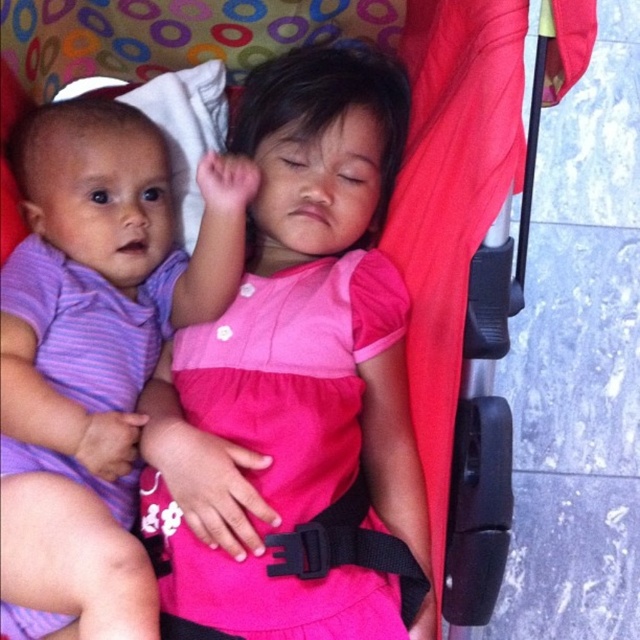
Question: From the image, what is the correct spatial relationship of pink fabric dress at center in relation to purple striped fabric at left?

Choices:
 (A) above
 (B) below

Answer: (A)

Question: Which of the following is the farthest from the observer?

Choices:
 (A) (364, 156)
 (B) (99, 198)

Answer: (A)

Question: Is pink fabric dress at center behind purple striped fabric at left?

Choices:
 (A) yes
 (B) no

Answer: (A)

Question: Is pink fabric dress at center above purple striped fabric at left?

Choices:
 (A) yes
 (B) no

Answer: (A)

Question: Which point is closer to the camera taking this photo?

Choices:
 (A) (300, 360)
 (B) (74, 218)

Answer: (A)